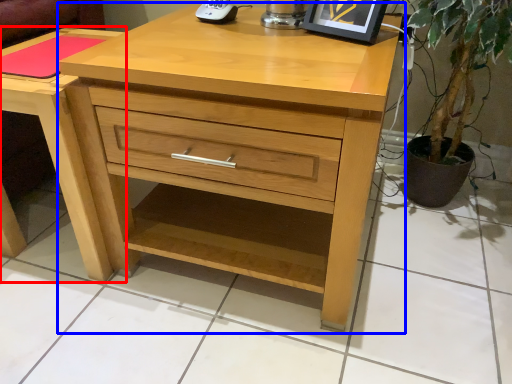
Question: Among these objects, which one is nearest to the camera, nightstand (highlighted by a red box) or chest of drawers (highlighted by a blue box)?

Choices:
 (A) nightstand
 (B) chest of drawers

Answer: (B)